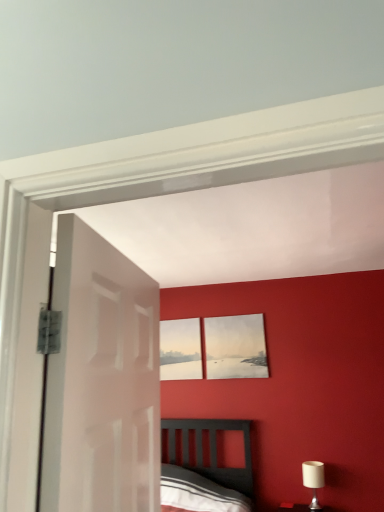
Find the location of a particular element. The height and width of the screenshot is (512, 384). white glossy door at left is located at coordinates (102, 380).

I want to click on white fabric-covered lampshade at lower right, so click(313, 480).

The image size is (384, 512). Identify the location of white glossy door at left. click(x=102, y=380).

Based on the photo, measure the distance from matte white picture frame at center, the 1th picture frame positioned from the left, to matte gray picture frame at upper center, the second picture frame positioned from the left.

They are 12.09 inches apart.

Which of these two, matte white picture frame at center, the 1th picture frame positioned from the left, or matte gray picture frame at upper center, the first picture frame positioned from the right, is wider?

With larger width is matte white picture frame at center, the 1th picture frame positioned from the left.

Is matte white picture frame at center, the second picture frame positioned from the right, placed right next to matte gray picture frame at upper center, the first picture frame positioned from the right?

matte white picture frame at center, the second picture frame positioned from the right, and matte gray picture frame at upper center, the first picture frame positioned from the right, are not in contact.

Locate an element on the screen. The height and width of the screenshot is (512, 384). picture frame that is on the right side of matte white picture frame at center, the 1th picture frame positioned from the left is located at coordinates (235, 347).

Can you confirm if matte white picture frame at center, the second picture frame positioned from the right, is bigger than white fabric-covered lampshade at lower right?

Incorrect, matte white picture frame at center, the second picture frame positioned from the right, is not larger than white fabric-covered lampshade at lower right.

Which is closer to the camera, (x=186, y=342) or (x=309, y=465)?

Point (x=186, y=342) appears to be farther away from the viewer than point (x=309, y=465).

From a real-world perspective, is matte white picture frame at center, the second picture frame positioned from the right, located beneath white fabric-covered lampshade at lower right?

No, from a real-world perspective, matte white picture frame at center, the second picture frame positioned from the right, is not beneath white fabric-covered lampshade at lower right.

From the image's perspective, is matte white picture frame at center, the 1th picture frame positioned from the left, located above white fabric-covered lampshade at lower right?

Correct, matte white picture frame at center, the 1th picture frame positioned from the left, appears higher than white fabric-covered lampshade at lower right in the image.

Can matte gray picture frame at upper center, the first picture frame positioned from the right, be found inside white glossy door at left?

No, white glossy door at left does not contain matte gray picture frame at upper center, the first picture frame positioned from the right.

Would you consider white glossy door at left to be distant from matte gray picture frame at upper center, the second picture frame positioned from the left?

That's right, there is a large distance between white glossy door at left and matte gray picture frame at upper center, the second picture frame positioned from the left.

From a real-world perspective, which object stands above the other?

matte gray picture frame at upper center, the second picture frame positioned from the left.

Consider the image. Is matte gray picture frame at upper center, the second picture frame positioned from the left, at the back of white glossy door at left?

white glossy door at left does not have its back to matte gray picture frame at upper center, the second picture frame positioned from the left.

Can you tell me how much matte white picture frame at center, the second picture frame positioned from the right, and white glossy door at left differ in facing direction?

matte white picture frame at center, the second picture frame positioned from the right, and white glossy door at left are facing 98.7 degrees away from each other.

Can we say matte white picture frame at center, the second picture frame positioned from the right, lies outside white glossy door at left?

That's correct, matte white picture frame at center, the second picture frame positioned from the right, is outside of white glossy door at left.

Does point (187, 360) come behind point (93, 485)?

That is True.

Between matte white picture frame at center, the 1th picture frame positioned from the left, and white glossy door at left, which one has less height?

Standing shorter between the two is matte white picture frame at center, the 1th picture frame positioned from the left.

You are a GUI agent. You are given a task and a screenshot of the screen. Output one action in this format:
    pyautogui.click(x=<x>, y=<y>)
    Task: Click on the 2nd picture frame to the left when counting from the white fabric-covered lampshade at lower right
    
    Given the screenshot: What is the action you would take?
    pyautogui.click(x=180, y=349)

In terms of size, does white fabric-covered lampshade at lower right appear bigger or smaller than matte white picture frame at center, the 1th picture frame positioned from the left?

In the image, white fabric-covered lampshade at lower right appears to be larger than matte white picture frame at center, the 1th picture frame positioned from the left.

What's the angular difference between white fabric-covered lampshade at lower right and matte white picture frame at center, the second picture frame positioned from the right,'s facing directions?

The angle between the facing direction of white fabric-covered lampshade at lower right and the facing direction of matte white picture frame at center, the second picture frame positioned from the right, is 0.995 degrees.

Is matte white picture frame at center, the second picture frame positioned from the right, at the back of white fabric-covered lampshade at lower right?

No, white fabric-covered lampshade at lower right is not facing away from matte white picture frame at center, the second picture frame positioned from the right.

The height and width of the screenshot is (512, 384). In order to click on picture frame on the right of matte white picture frame at center, the second picture frame positioned from the right in this screenshot , I will do `click(235, 347)`.

Would you say matte gray picture frame at upper center, the first picture frame positioned from the right, is to the left or to the right of matte white picture frame at center, the 1th picture frame positioned from the left, in the picture?

Based on their positions, matte gray picture frame at upper center, the first picture frame positioned from the right, is located to the right of matte white picture frame at center, the 1th picture frame positioned from the left.

Does point (224, 344) come in front of point (173, 369)?

Yes, point (224, 344) is closer to viewer.

Is matte gray picture frame at upper center, the first picture frame positioned from the right, smaller than matte white picture frame at center, the second picture frame positioned from the right?

No.

At what (x,y) coordinates should I click in order to perform the action: click on table lamp on the right of white glossy door at left. Please return your answer as a coordinate pair (x, y). This screenshot has height=512, width=384. Looking at the image, I should click on (313, 480).

Is white glossy door at left closer to camera compared to white fabric-covered lampshade at lower right?

Yes, white glossy door at left is in front of white fabric-covered lampshade at lower right.

Is white glossy door at left facing towards white fabric-covered lampshade at lower right?

No, white glossy door at left is not aimed at white fabric-covered lampshade at lower right.

Which object is thinner, white glossy door at left or white fabric-covered lampshade at lower right?

→ white glossy door at left.

The height and width of the screenshot is (512, 384). Identify the location of picture frame below the matte white picture frame at center, the second picture frame positioned from the right (from a real-world perspective). (235, 347).

From the image's perspective, count 1st picture frames upward from the white fabric-covered lampshade at lower right and point to it. Please provide its 2D coordinates.

[(180, 349)]

Based on their spatial positions, is white fabric-covered lampshade at lower right or matte gray picture frame at upper center, the first picture frame positioned from the right, further from matte white picture frame at center, the second picture frame positioned from the right?

white fabric-covered lampshade at lower right is further to matte white picture frame at center, the second picture frame positioned from the right.

Considering their positions, is white glossy door at left positioned further to matte gray picture frame at upper center, the second picture frame positioned from the left, than white fabric-covered lampshade at lower right?

white glossy door at left is further to matte gray picture frame at upper center, the second picture frame positioned from the left.

Based on their spatial positions, is matte white picture frame at center, the second picture frame positioned from the right, or white glossy door at left closer to white fabric-covered lampshade at lower right?

matte white picture frame at center, the second picture frame positioned from the right, lies closer to white fabric-covered lampshade at lower right than the other object.

Estimate the real-world distances between objects in this image. Which object is further from matte white picture frame at center, the second picture frame positioned from the right, matte gray picture frame at upper center, the second picture frame positioned from the left, or white fabric-covered lampshade at lower right?

Among the two, white fabric-covered lampshade at lower right is located further to matte white picture frame at center, the second picture frame positioned from the right.

When comparing their distances from matte white picture frame at center, the second picture frame positioned from the right, does matte gray picture frame at upper center, the second picture frame positioned from the left, or white glossy door at left seem further?

Based on the image, white glossy door at left appears to be further to matte white picture frame at center, the second picture frame positioned from the right.

In the scene shown: Estimate the real-world distances between objects in this image. Which object is closer to white glossy door at left, matte white picture frame at center, the 1th picture frame positioned from the left, or white fabric-covered lampshade at lower right?

Based on the image, matte white picture frame at center, the 1th picture frame positioned from the left, appears to be nearer to white glossy door at left.

Estimate the real-world distances between objects in this image. Which object is further from matte gray picture frame at upper center, the second picture frame positioned from the left, white fabric-covered lampshade at lower right or white glossy door at left?

white glossy door at left is positioned further to the anchor matte gray picture frame at upper center, the second picture frame positioned from the left.

When comparing their distances from matte gray picture frame at upper center, the first picture frame positioned from the right, does matte white picture frame at center, the second picture frame positioned from the right, or white glossy door at left seem closer?

Based on the image, matte white picture frame at center, the second picture frame positioned from the right, appears to be nearer to matte gray picture frame at upper center, the first picture frame positioned from the right.

The image size is (384, 512). In order to click on picture frame positioned between white glossy door at left and matte white picture frame at center, the second picture frame positioned from the right, from near to far in this screenshot , I will do `click(235, 347)`.

Where is `table lamp between white glossy door at left and matte white picture frame at center, the second picture frame positioned from the right, from front to back`? table lamp between white glossy door at left and matte white picture frame at center, the second picture frame positioned from the right, from front to back is located at coordinates (313, 480).

At what (x,y) coordinates should I click in order to perform the action: click on table lamp between white glossy door at left and matte gray picture frame at upper center, the second picture frame positioned from the left, from front to back. Please return your answer as a coordinate pair (x, y). Looking at the image, I should click on (313, 480).

At what (x,y) coordinates should I click in order to perform the action: click on picture frame situated between matte white picture frame at center, the second picture frame positioned from the right, and white fabric-covered lampshade at lower right from left to right. Please return your answer as a coordinate pair (x, y). Looking at the image, I should click on (235, 347).